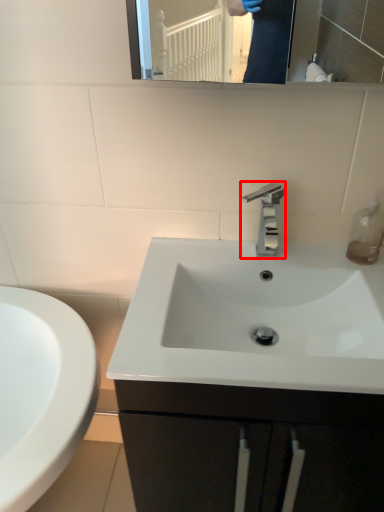
Question: From the image's perspective, considering the relative positions of tap (annotated by the red box) and soap dispenser in the image provided, where is tap (annotated by the red box) located with respect to the staircase?

Choices:
 (A) below
 (B) above

Answer: (B)